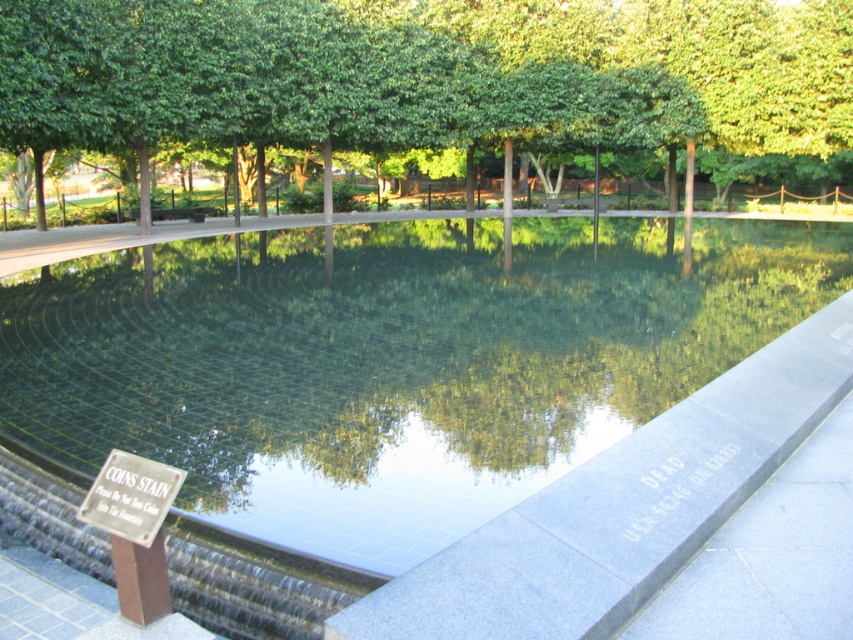
Question: Does clear glass pool at center appear over metallic silver sign at lower left?

Choices:
 (A) yes
 (B) no

Answer: (A)

Question: Can you confirm if clear glass pool at center is smaller than metallic silver sign at lower left?

Choices:
 (A) yes
 (B) no

Answer: (B)

Question: Which of the following is the farthest from the observer?

Choices:
 (A) green leafy tree at center
 (B) clear glass pool at center
 (C) metallic silver sign at lower left

Answer: (A)

Question: Where is clear glass pool at center located in relation to metallic silver sign at lower left in the image?

Choices:
 (A) right
 (B) left

Answer: (A)

Question: Which point appears closest to the camera in this image?

Choices:
 (A) (439, 108)
 (B) (137, 544)
 (C) (514, 221)

Answer: (B)

Question: Which of the following is the closest to the observer?

Choices:
 (A) (373, 381)
 (B) (94, 509)
 (C) (318, 61)

Answer: (B)